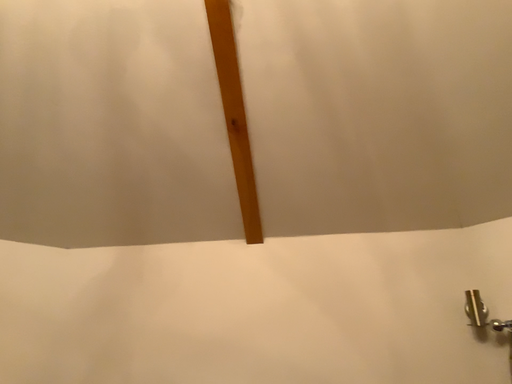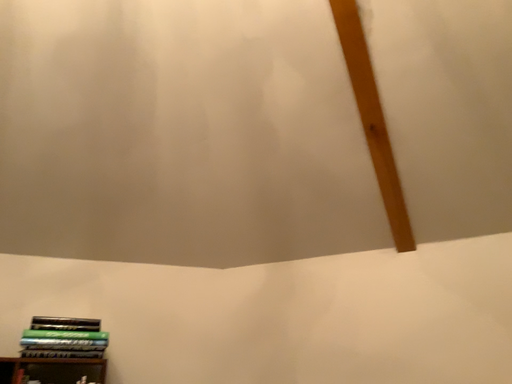
Question: Which way did the camera rotate in the video?

Choices:
 (A) rotated left
 (B) rotated right

Answer: (A)